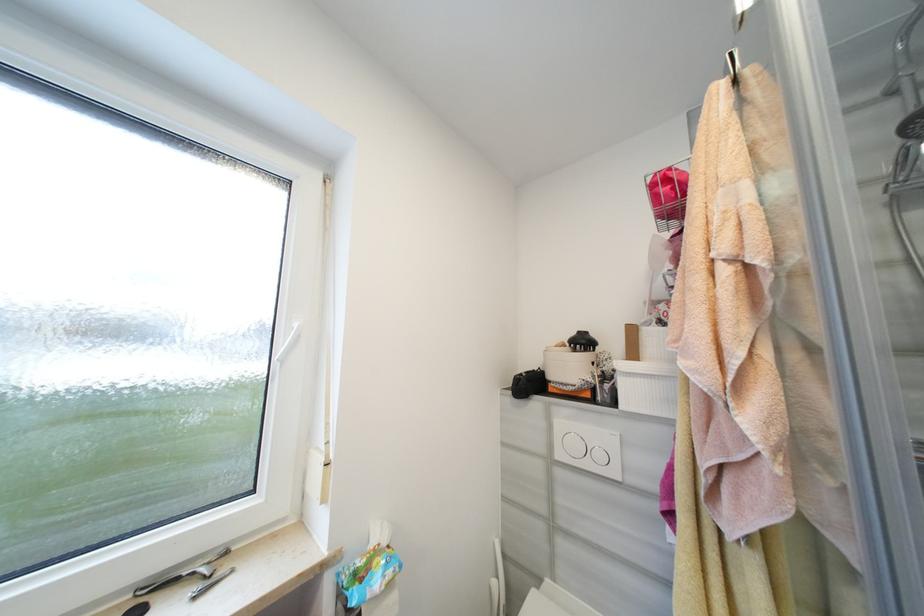
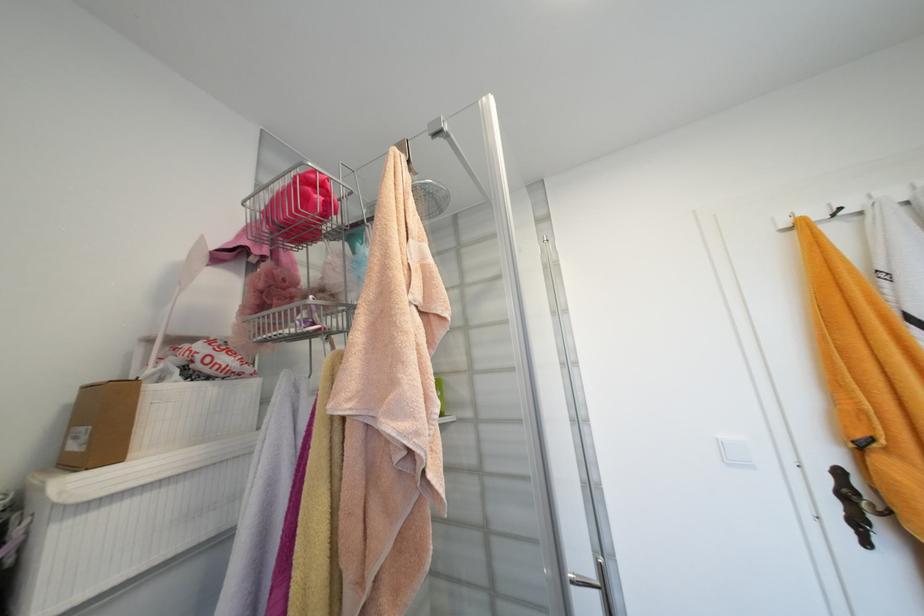
Locate, in the second image, the point that corresponds to point 659,187 in the first image.

(312, 182)